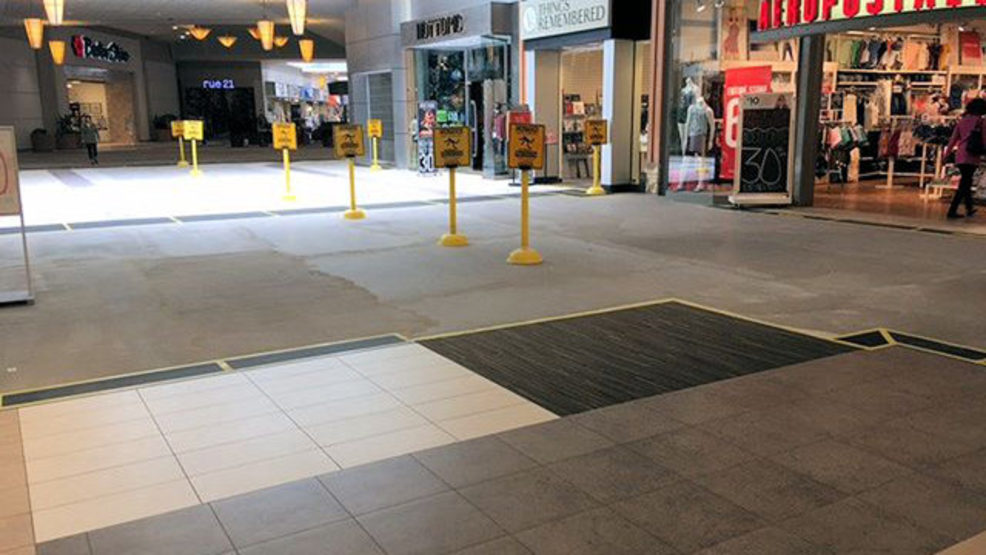
Identify the location of ambient ceiling lighting. (57, 52), (28, 31), (56, 3), (200, 34), (229, 45), (266, 31), (296, 6), (308, 48), (279, 39), (252, 31).